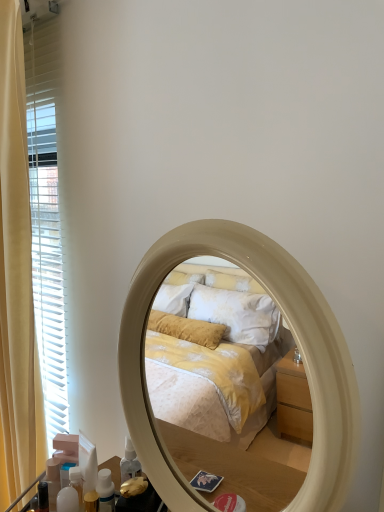
Question: Considering the positions of point (11, 431) and point (51, 458), is point (11, 431) closer or farther from the camera than point (51, 458)?

Choices:
 (A) farther
 (B) closer

Answer: (A)

Question: In terms of size, does yellow fabric curtain at left appear bigger or smaller than translucent plastic bottle at lower left, the first toiletry viewed from the left?

Choices:
 (A) big
 (B) small

Answer: (A)

Question: Based on their relative distances, which object is farther from the yellow fabric curtain at left?

Choices:
 (A) translucent plastic bottles at lower left, the 1th toiletry from the right
 (B) translucent plastic bottle at lower left, arranged as the 2th toiletry when viewed from the front
 (C) beige glossy mirror at center

Answer: (C)

Question: Considering the real-world distances, which object is closest to the translucent plastic bottle at lower left, arranged as the 2th toiletry when viewed from the front?

Choices:
 (A) translucent plastic bottles at lower left, the 2th toiletry viewed from the left
 (B) beige glossy mirror at center
 (C) yellow fabric curtain at left

Answer: (A)